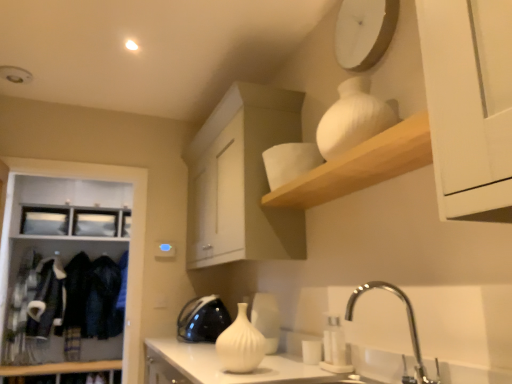
Question: Is white matte vase at upper center at the back of white glossy vase at center?

Choices:
 (A) no
 (B) yes

Answer: (A)

Question: Is white glossy vase at center closer to camera compared to white matte vase at upper center?

Choices:
 (A) yes
 (B) no

Answer: (B)

Question: Does white glossy vase at center appear on the right side of white matte vase at upper center?

Choices:
 (A) yes
 (B) no

Answer: (B)

Question: Is white glossy vase at center further to the viewer compared to white matte vase at upper center?

Choices:
 (A) no
 (B) yes

Answer: (B)

Question: Does white glossy vase at center contain white matte vase at upper center?

Choices:
 (A) yes
 (B) no

Answer: (B)

Question: Is fuzzy black jacket at left taller or shorter than white ribbed vase at center, the 1th glass vase from the left?

Choices:
 (A) short
 (B) tall

Answer: (B)

Question: From a real-world perspective, is fuzzy black jacket at left above or below white ribbed vase at center, the second glass vase when ordered from top to bottom?

Choices:
 (A) above
 (B) below

Answer: (A)

Question: Is point (26, 327) positioned closer to the camera than point (238, 345)?

Choices:
 (A) closer
 (B) farther

Answer: (B)

Question: Is fuzzy black jacket at left wider or thinner than white ribbed vase at center, the 2th glass vase when ordered from right to left?

Choices:
 (A) wide
 (B) thin

Answer: (A)

Question: From a real-world perspective, is white ribbed vase at upper right, arranged as the second glass vase when ordered from the bottom, physically located above or below white glossy vase at center, arranged as the second appliance when viewed from the back?

Choices:
 (A) above
 (B) below

Answer: (A)

Question: In terms of size, does white ribbed vase at upper right, placed as the first glass vase when sorted from top to bottom, appear bigger or smaller than white glossy vase at center, the 2th appliance positioned from the left?

Choices:
 (A) small
 (B) big

Answer: (B)

Question: Is white ribbed vase at upper right, placed as the first glass vase when sorted from top to bottom, wider or thinner than white glossy vase at center, marked as the 1th appliance in a front-to-back arrangement?

Choices:
 (A) wide
 (B) thin

Answer: (A)

Question: Relative to white glossy vase at center, marked as the 1th appliance in a front-to-back arrangement, is white ribbed vase at upper right, arranged as the second glass vase when ordered from the bottom, in front or behind?

Choices:
 (A) behind
 (B) front

Answer: (B)

Question: Is polished chrome faucet at lower right inside the boundaries of white matte clock at upper center, or outside?

Choices:
 (A) outside
 (B) inside

Answer: (A)

Question: From the image's perspective, is polished chrome faucet at lower right positioned above or below white matte clock at upper center?

Choices:
 (A) below
 (B) above

Answer: (A)